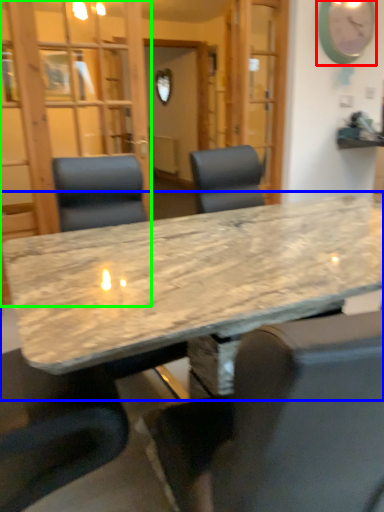
Question: Estimate the real-world distances between objects in this image. Which object is farther from clock (highlighted by a red box), table (highlighted by a blue box) or glass door (highlighted by a green box)?

Choices:
 (A) table
 (B) glass door

Answer: (A)